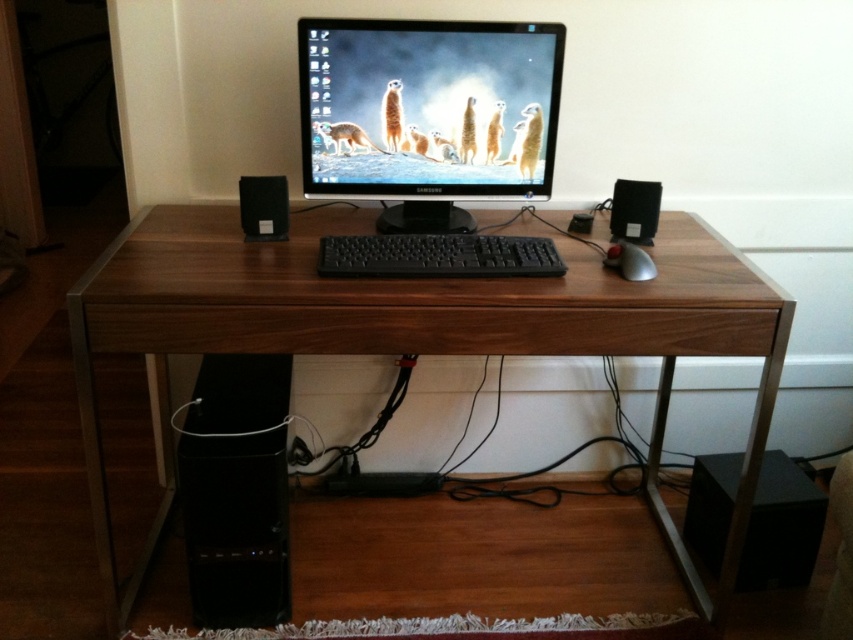
Question: Is walnut wood desk at center above black plastic speaker at right?

Choices:
 (A) no
 (B) yes

Answer: (A)

Question: Is matte black monitor at center below rubberized black mouse at right?

Choices:
 (A) no
 (B) yes

Answer: (A)

Question: Which of these objects is positioned farthest from the black matte speaker at left?

Choices:
 (A) matte black monitor at center
 (B) walnut wood desk at center
 (C) black plastic speaker at right

Answer: (C)

Question: Is the position of black matte speaker at left less distant than that of black plastic speaker at right?

Choices:
 (A) no
 (B) yes

Answer: (B)

Question: Among these objects, which one is nearest to the camera?

Choices:
 (A) black plastic speaker at right
 (B) rubberized black mouse at right
 (C) black matte speaker at left
 (D) matte black monitor at center

Answer: (B)

Question: Which object is positioned closest to the rubberized black mouse at right?

Choices:
 (A) black matte speaker at left
 (B) walnut wood desk at center

Answer: (B)